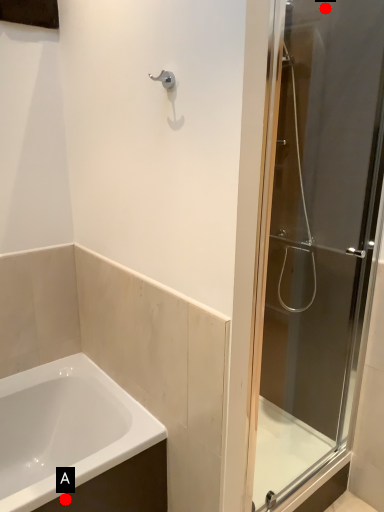
Question: Two points are circled on the image, labeled by A and B beside each circle. Among these points, which one is farthest from the camera?

Choices:
 (A) A is further
 (B) B is further

Answer: (B)